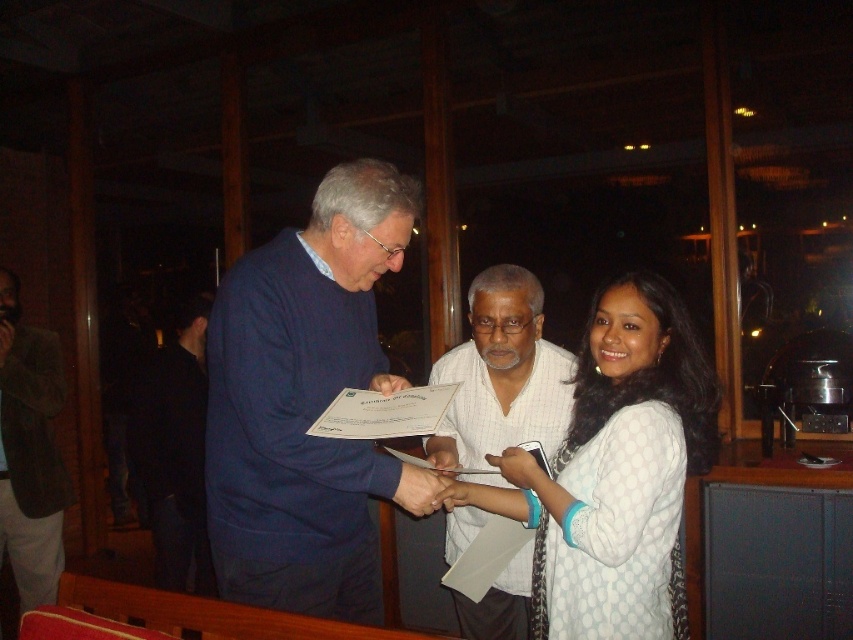
You are attending an event and see the dark blue sweater at center and the black fabric shirt at left. Which one is closer to you?

The dark blue sweater at center is closer to you because it is in front of the black fabric shirt at left.